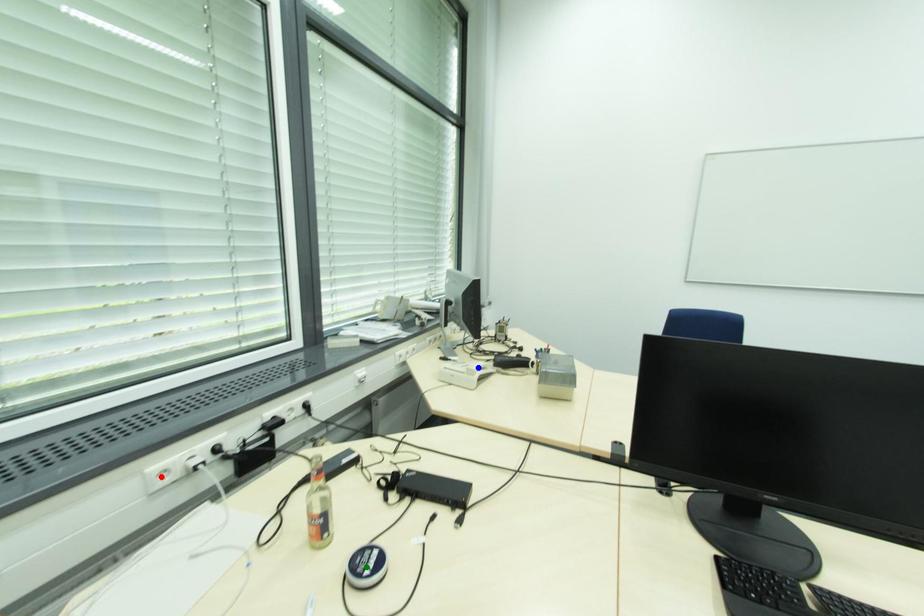
Order these from nearest to farthest:
green point | blue point | red point

green point
red point
blue point